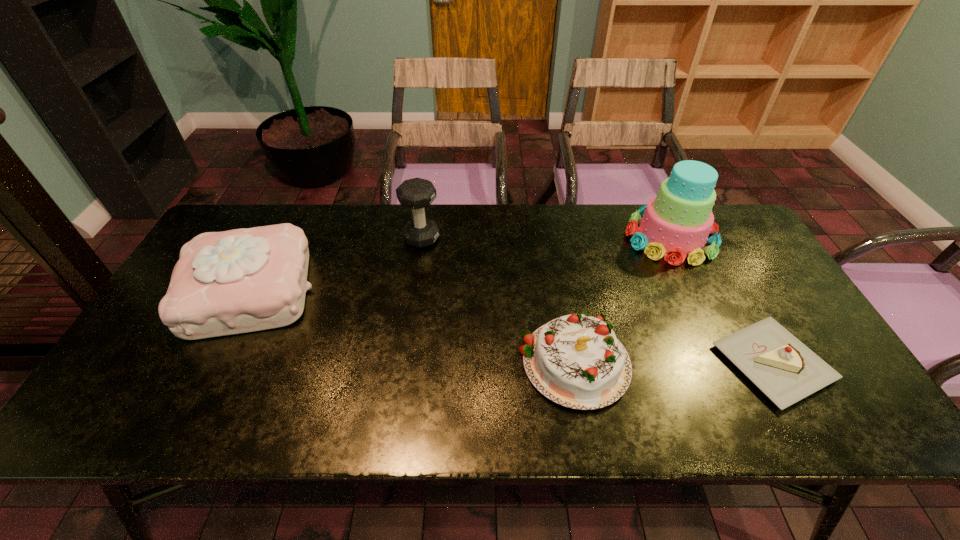
Where is `free space that is in between the shortest object and the leftmost cake`? free space that is in between the shortest object and the leftmost cake is located at coordinates (511, 327).

Where is `free point between the leftmost cake and the shortest cake`? Image resolution: width=960 pixels, height=540 pixels. free point between the leftmost cake and the shortest cake is located at coordinates (511, 327).

Where is `vacant area that lies between the leftmost object and the third object from left to right`? This screenshot has height=540, width=960. vacant area that lies between the leftmost object and the third object from left to right is located at coordinates (412, 326).

Where is `vacant region between the tallest object and the third object from right to left`? vacant region between the tallest object and the third object from right to left is located at coordinates (x=622, y=299).

Identify the location of free space between the third object from right to left and the tallest object. (622, 299).

Find the location of `free space between the tallest object and the shortest cake`. free space between the tallest object and the shortest cake is located at coordinates (722, 300).

Identify the location of free space that is in between the second cake from left to right and the tallest object. (622, 299).

At what (x,y) coordinates should I click in order to perform the action: click on free space between the tallest object and the shortest object. Please return your answer as a coordinate pair (x, y). Looking at the image, I should click on (722, 300).

Where is `vacant area between the second tallest object and the leftmost cake`? Image resolution: width=960 pixels, height=540 pixels. vacant area between the second tallest object and the leftmost cake is located at coordinates (335, 265).

Image resolution: width=960 pixels, height=540 pixels. I want to click on vacant area that lies between the shortest cake and the second object from left to right, so click(597, 300).